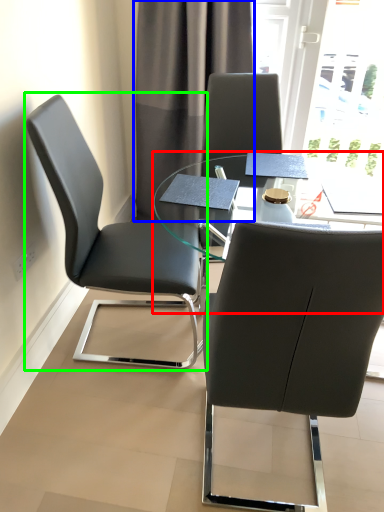
Question: Based on their relative distances, which object is nearer to table (highlighted by a red box)? Choose from curtain (highlighted by a blue box) and chair (highlighted by a green box).

Choices:
 (A) curtain
 (B) chair

Answer: (B)